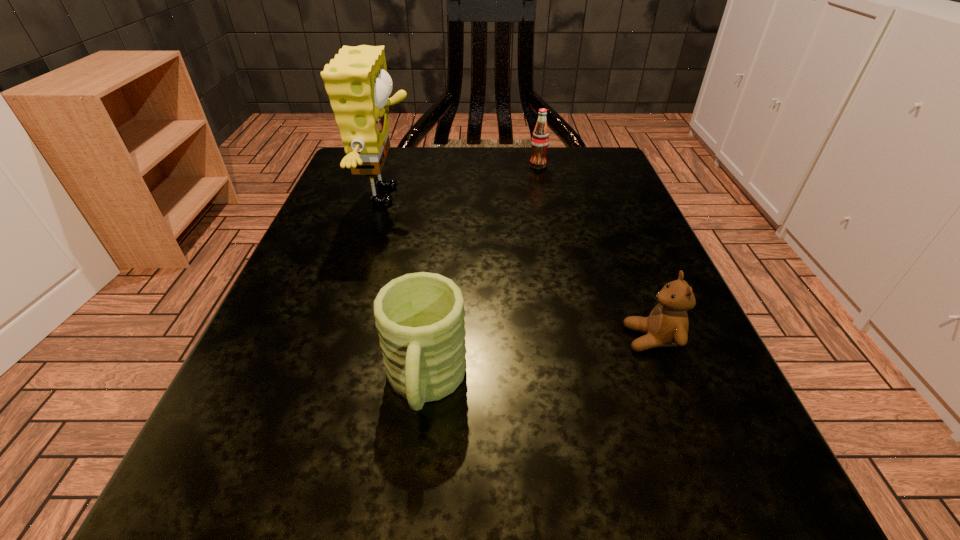
In the image, there is a desktop. Where is `vacant space at the left edge`? This screenshot has height=540, width=960. vacant space at the left edge is located at coordinates (403, 206).

In the image, there is a desktop. Where is `vacant space at the right edge`? vacant space at the right edge is located at coordinates (561, 237).

In the image, there is a desktop. Where is `free space at the far left corner`? The width and height of the screenshot is (960, 540). free space at the far left corner is located at coordinates (342, 195).

What are the coordinates of `vacant area at the near left corner of the desktop` in the screenshot? It's located at (220, 507).

In the image, there is a desktop. Find the location of `vacant space at the far right corner`. vacant space at the far right corner is located at coordinates (636, 197).

I want to click on free region at the near right corner of the desktop, so click(x=722, y=536).

Identify the location of blank region between the soda and the leftmost object. This screenshot has height=540, width=960. (464, 181).

The height and width of the screenshot is (540, 960). Identify the location of vacant region between the mug and the shortest object. (539, 362).

Locate an element on the screen. The height and width of the screenshot is (540, 960). unoccupied position between the rightmost object and the soda is located at coordinates (595, 252).

Find the location of a particular element. The width and height of the screenshot is (960, 540). free point between the sponge and the shortest object is located at coordinates (520, 267).